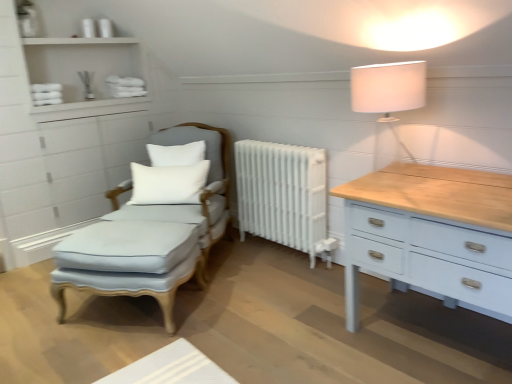
Where is `vacant area that is in front of light blue fabric footrest at center`? This screenshot has width=512, height=384. vacant area that is in front of light blue fabric footrest at center is located at coordinates (135, 354).